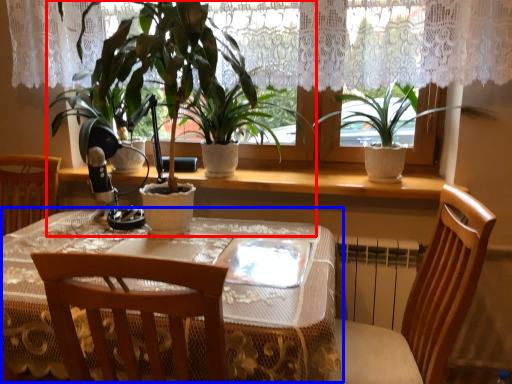
Question: Among these objects, which one is nearest to the camera, houseplant (highlighted by a red box) or table (highlighted by a blue box)?

Choices:
 (A) houseplant
 (B) table

Answer: (B)